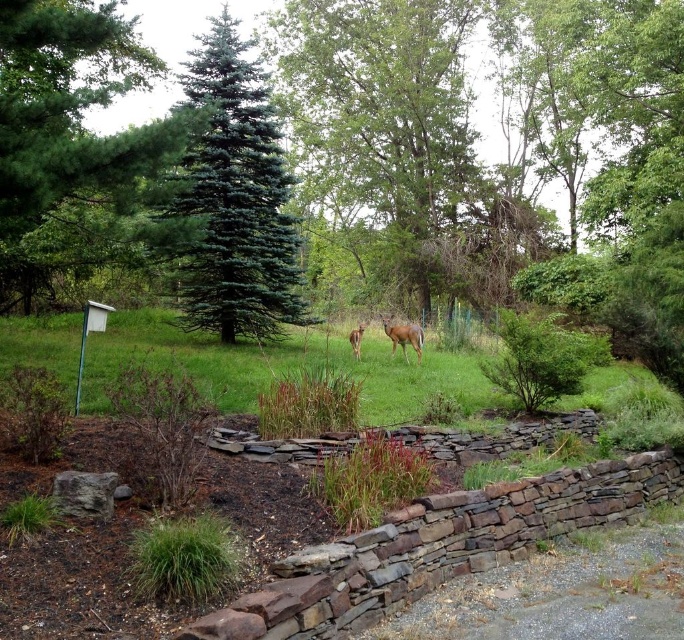
Is point (116, 195) in front of point (342, 332)?

Yes, point (116, 195) is closer to viewer.

Can you confirm if green coniferous tree at left is positioned to the right of green grass at center?

Incorrect, green coniferous tree at left is not on the right side of green grass at center.

Is point (66, 49) in front of point (256, 380)?

Yes, it is in front of point (256, 380).

Find the location of `green coniferous tree at left`. green coniferous tree at left is located at coordinates (75, 145).

Does blue-green coniferous tree at upper left lie behind brown furry deer at center?

No, blue-green coniferous tree at upper left is closer to the viewer.

Does blue-green coniferous tree at upper left appear under brown furry deer at center?

Result: No, blue-green coniferous tree at upper left is not below brown furry deer at center.

Does point (233, 166) come farther from viewer compared to point (358, 337)?

Yes, it is.

The image size is (684, 640). I want to click on blue-green coniferous tree at upper left, so click(x=233, y=200).

Which is below, green coniferous tree at left or brown matte/deer at center?

brown matte/deer at center is lower down.

Consider the image. Does green coniferous tree at left appear over brown matte/deer at center?

Yes.

Which is in front, point (52, 166) or point (412, 346)?

Point (52, 166) is more forward.

Locate an element on the screen. The height and width of the screenshot is (640, 684). green coniferous tree at left is located at coordinates (75, 145).